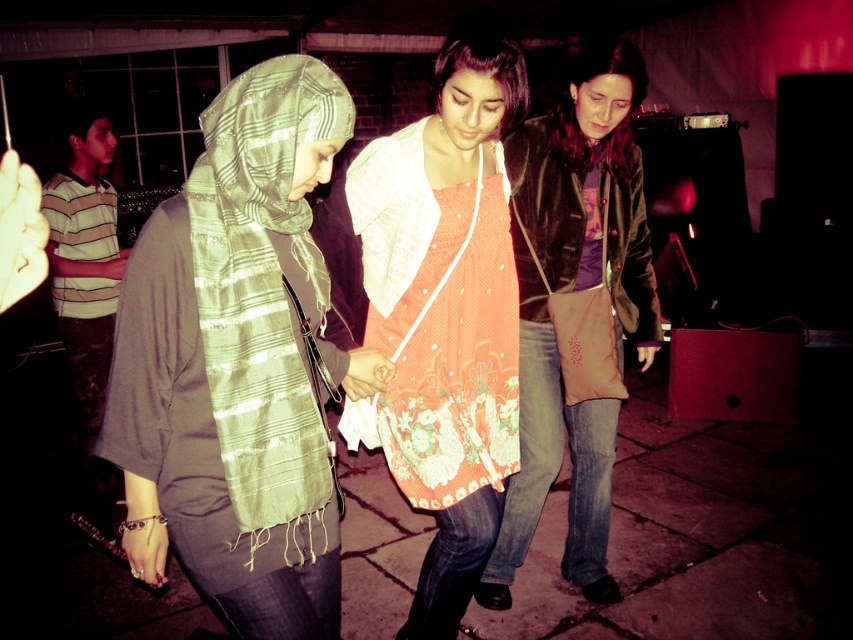
You are a photographer trying to capture a candid shot of the two items mentioned in the scene. Given that your camera has a maximum focus range of 2 meters, can you capture both the green striped scarf at left and the striped cotton shirt at left in the same frame without moving the camera?

The green striped scarf at left and the striped cotton shirt at left are 1.96 meters apart from each other. Since the distance between them is within the camera maximum focus range of 2 meters, you can capture both items in the same frame without moving the camera.

You are a photographer trying to capture a photo of the two people at the center of the scene. Since the orange printed dress at center and brown suede jacket at center are close to each other, which one would you focus on to ensure the subject is in the frame without cropping?

The orange printed dress at center is narrower than the brown suede jacket at center, so focusing on the orange printed dress at center would ensure it fits within the frame without cropping.

You are at a nighttime event with a group of friends. You notice two items in the scene described as the green striped scarf at left and the brown suede jacket at center. Which item is covering part of the other?

The green striped scarf at left is positioned over the brown suede jacket at center, so it is covering part of it.